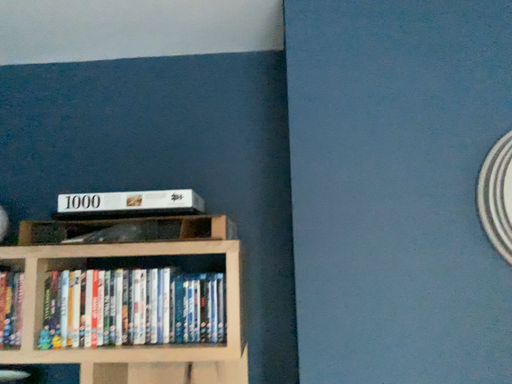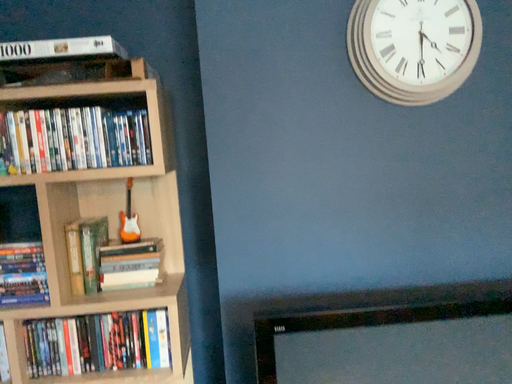
Question: How did the camera likely rotate when shooting the video?

Choices:
 (A) rotated upward
 (B) rotated downward

Answer: (B)